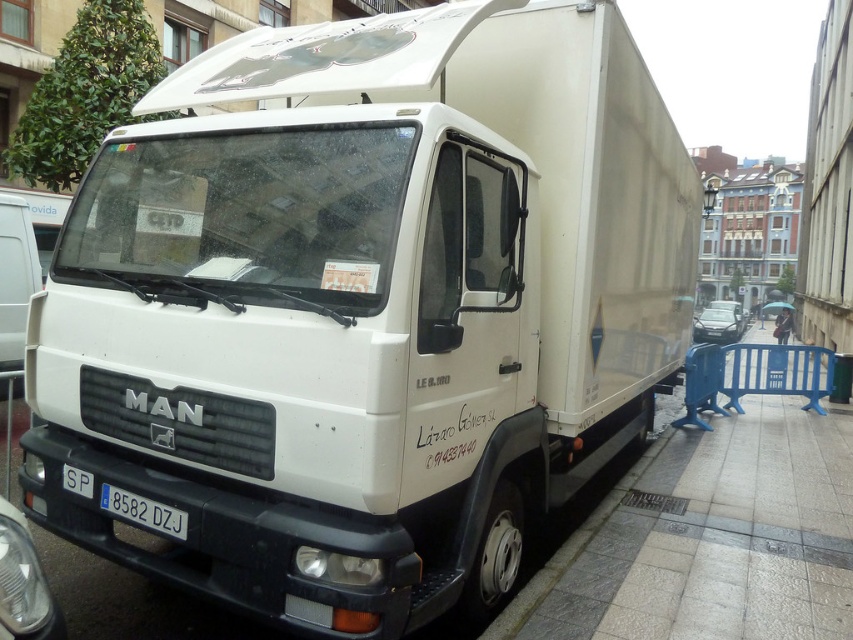
You are a delivery driver who needs to check the license plate of the white plastic license plate at lower center. Since the white matte van at left is blocking your view, can you estimate if you can see the license plate clearly from your current position?

The white matte van at left has a larger size compared to white plastic license plate at lower center, so it might block the view of the license plate. You may need to move to a different position to see the license plate clearly.